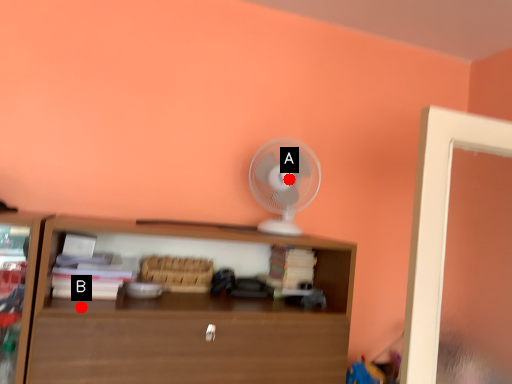
Question: Two points are circled on the image, labeled by A and B beside each circle. Which point is closer to the camera?

Choices:
 (A) A is closer
 (B) B is closer

Answer: (B)